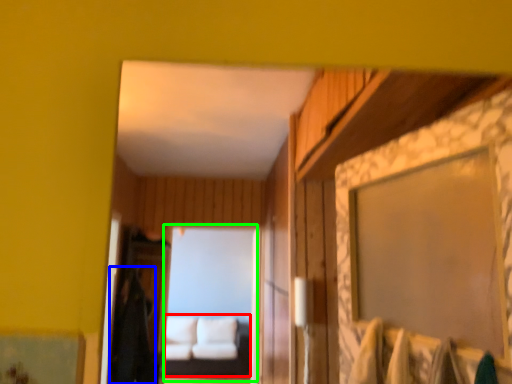
Question: Which object is positioned closest to couch (highlighted by a red box)? Select from robe (highlighted by a blue box) and mirror (highlighted by a green box).

Choices:
 (A) robe
 (B) mirror

Answer: (B)